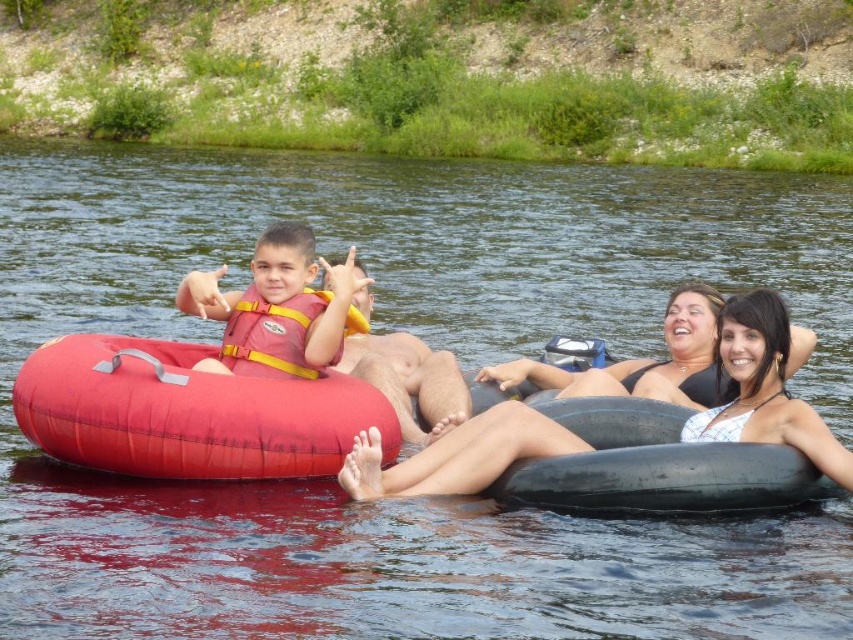
Question: Based on their relative distances, which object is nearer to the white bikini top at center?

Choices:
 (A) rubber red tube at left
 (B) orange/yellow life jacket at left

Answer: (A)

Question: Which of the following is the closest to the observer?

Choices:
 (A) (184, 280)
 (B) (494, 428)

Answer: (B)

Question: Is matte pink life vest at left positioned in front of orange/yellow life jacket at left?

Choices:
 (A) yes
 (B) no

Answer: (A)

Question: In this image, where is rubber red tube at left located relative to matte pink life vest at left?

Choices:
 (A) right
 (B) left

Answer: (A)

Question: Which of the following is the farthest from the observer?

Choices:
 (A) (241, 349)
 (B) (262, 300)

Answer: (B)

Question: Is rubber red tube at left above matte pink life vest at left?

Choices:
 (A) no
 (B) yes

Answer: (A)